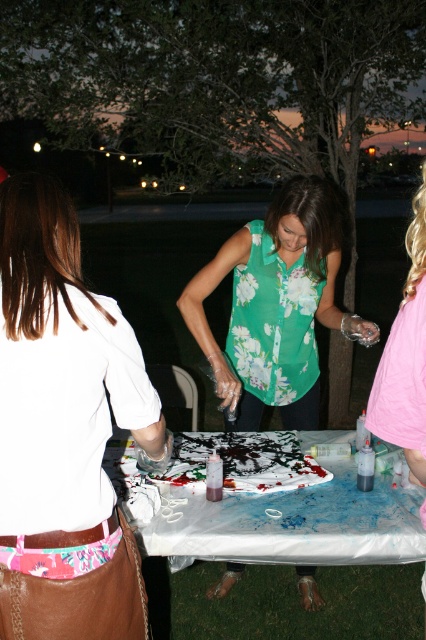
You are at a night gathering and want to place your white leather purse at lower left on the white plastic picnic table at center. Is it possible to put it there without moving any other items?

The white leather purse at lower left is already above the white plastic picnic table at center, so you can place it there without moving other items.

You are standing at the edge of the park and want to reach the white plastic picnic table at center to help with the painting activity. However, there is a person wearing a floral green blouse at center in your way. Can you walk directly to the table without going around?

The white plastic picnic table at center is in front of the floral green blouse at center, so the table is closer to you than the person. You can walk directly to the table without needing to go around.

You are standing at the edge of the park and want to place a small stool between the white plastic picnic table at center and the floral green blouse at center. Based on their positions, which side of the table should you place the stool on?

The white plastic picnic table at center is positioned on the left side of the floral green blouse at center, so to place the stool between them, you should put it on the right side of the table.